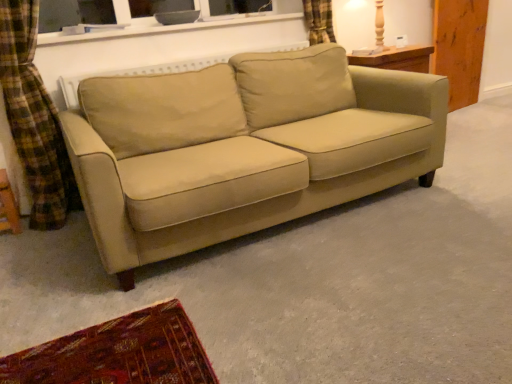
Question: From a real-world perspective, does beige fabric couch at center stand above wooden table lamp at upper right?

Choices:
 (A) no
 (B) yes

Answer: (A)

Question: Does beige fabric couch at center have a greater width compared to wooden table lamp at upper right?

Choices:
 (A) no
 (B) yes

Answer: (B)

Question: From a real-world perspective, is beige fabric couch at center positioned under wooden table lamp at upper right based on gravity?

Choices:
 (A) no
 (B) yes

Answer: (B)

Question: Can you confirm if beige fabric couch at center is thinner than wooden table lamp at upper right?

Choices:
 (A) no
 (B) yes

Answer: (A)

Question: Does beige fabric couch at center touch wooden table lamp at upper right?

Choices:
 (A) yes
 (B) no

Answer: (B)

Question: From the image's perspective, would you say beige fabric couch at center is positioned over wooden table lamp at upper right?

Choices:
 (A) no
 (B) yes

Answer: (A)

Question: Is the position of wooden table lamp at upper right less distant than that of beige fabric couch at center?

Choices:
 (A) no
 (B) yes

Answer: (A)

Question: Is wooden table lamp at upper right wider than beige fabric couch at center?

Choices:
 (A) yes
 (B) no

Answer: (B)

Question: Does wooden table lamp at upper right have a greater height compared to beige fabric couch at center?

Choices:
 (A) no
 (B) yes

Answer: (A)

Question: Is wooden table lamp at upper right behind beige fabric couch at center?

Choices:
 (A) yes
 (B) no

Answer: (A)

Question: From the image's perspective, is wooden table lamp at upper right above beige fabric couch at center?

Choices:
 (A) no
 (B) yes

Answer: (B)

Question: From the image's perspective, is wooden table lamp at upper right beneath beige fabric couch at center?

Choices:
 (A) yes
 (B) no

Answer: (B)

Question: In terms of height, does beige fabric couch at center look taller or shorter compared to wooden table lamp at upper right?

Choices:
 (A) short
 (B) tall

Answer: (B)